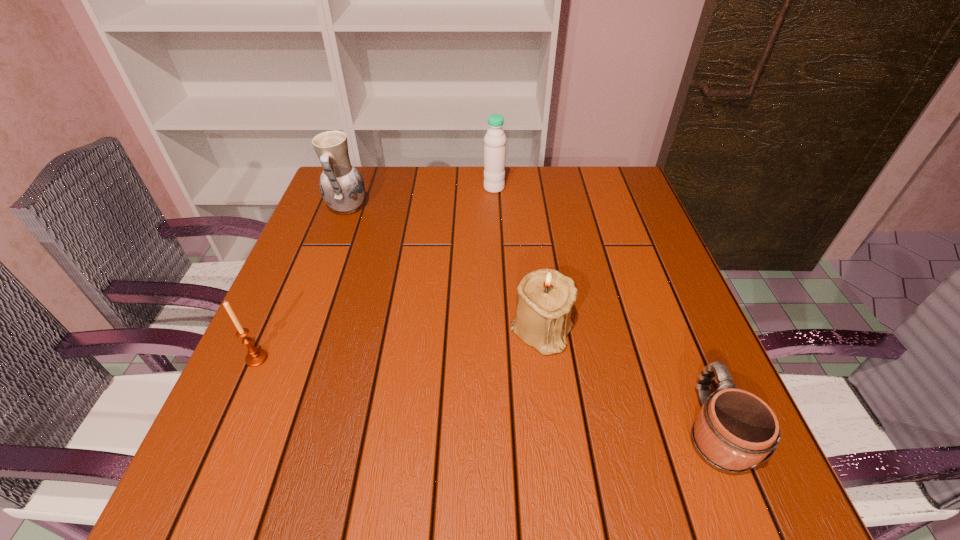
Image resolution: width=960 pixels, height=540 pixels. In order to click on free space between the mug and the water bottle in this screenshot , I will do `click(604, 308)`.

Image resolution: width=960 pixels, height=540 pixels. What are the coordinates of `vacant space that is in between the right candle_holder and the pottery` in the screenshot? It's located at (444, 269).

Where is `free space between the water bottle and the pottery`? This screenshot has height=540, width=960. free space between the water bottle and the pottery is located at coordinates (420, 198).

Where is `vacant area between the right candle_holder and the water bottle`? The width and height of the screenshot is (960, 540). vacant area between the right candle_holder and the water bottle is located at coordinates (518, 259).

Identify the location of free spot between the right candle_holder and the pottery. This screenshot has width=960, height=540. (444, 269).

You are a GUI agent. You are given a task and a screenshot of the screen. Output one action in this format:
    pyautogui.click(x=<x>, y=<y>)
    Task: Click on the empty space that is in between the water bottle and the right candle_holder
    The image size is (960, 540).
    Given the screenshot: What is the action you would take?
    pyautogui.click(x=518, y=259)

I want to click on free space between the left candle_holder and the right candle_holder, so click(399, 345).

Select which object is the fourth closest to the rightmost object. Please provide its 2D coordinates. Your answer should be formatted as a tuple, i.e. [(x, y)], where the tuple contains the x and y coordinates of a point satisfying the conditions above.

[(341, 185)]

Image resolution: width=960 pixels, height=540 pixels. What are the coordinates of `object that is the second closest to the left candle_holder` in the screenshot? It's located at (545, 297).

Where is `free space that satisfies the following two spatial constraints: 1. on either side of the pottery; 2. on the side of the shortest object with the handle`? free space that satisfies the following two spatial constraints: 1. on either side of the pottery; 2. on the side of the shortest object with the handle is located at coordinates (266, 429).